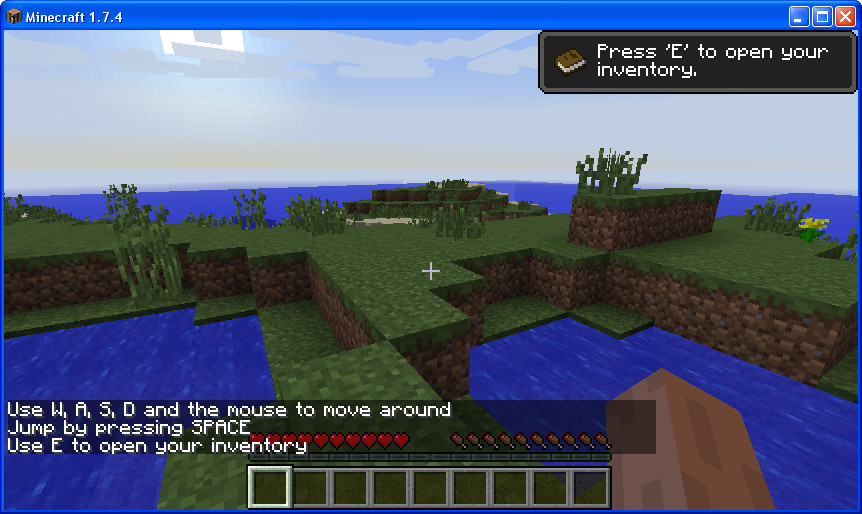
Locate an element on the screen. The width and height of the screenshot is (862, 514). book is located at coordinates (566, 61).